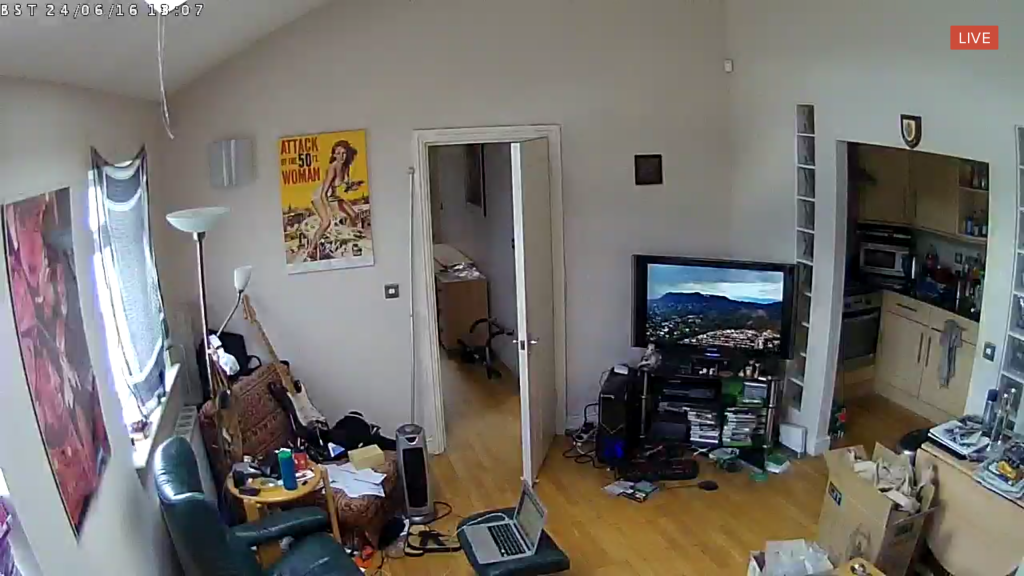
Where is `open laptop`? open laptop is located at coordinates (518, 534).